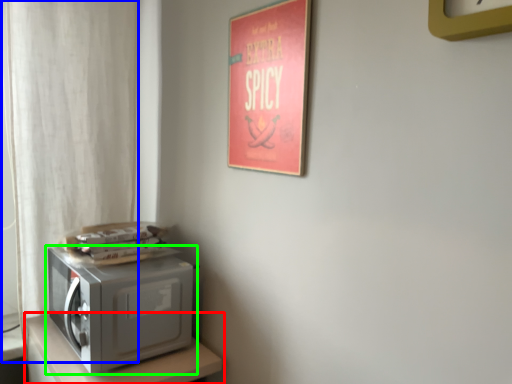
Question: Based on their relative distances, which object is nearer to furniture (highlighted by a red box)? Choose from curtain (highlighted by a blue box) and home appliance (highlighted by a green box).

Choices:
 (A) curtain
 (B) home appliance

Answer: (B)